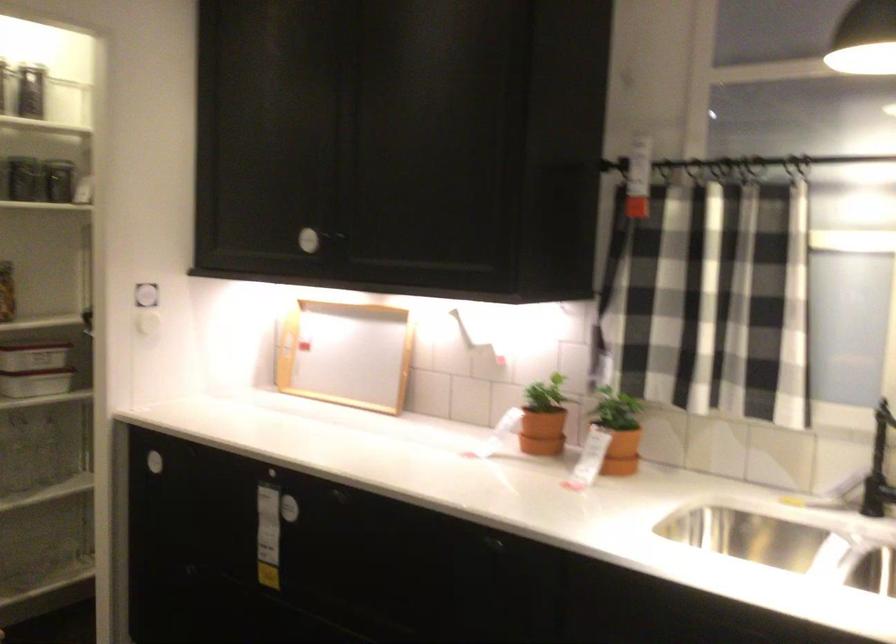
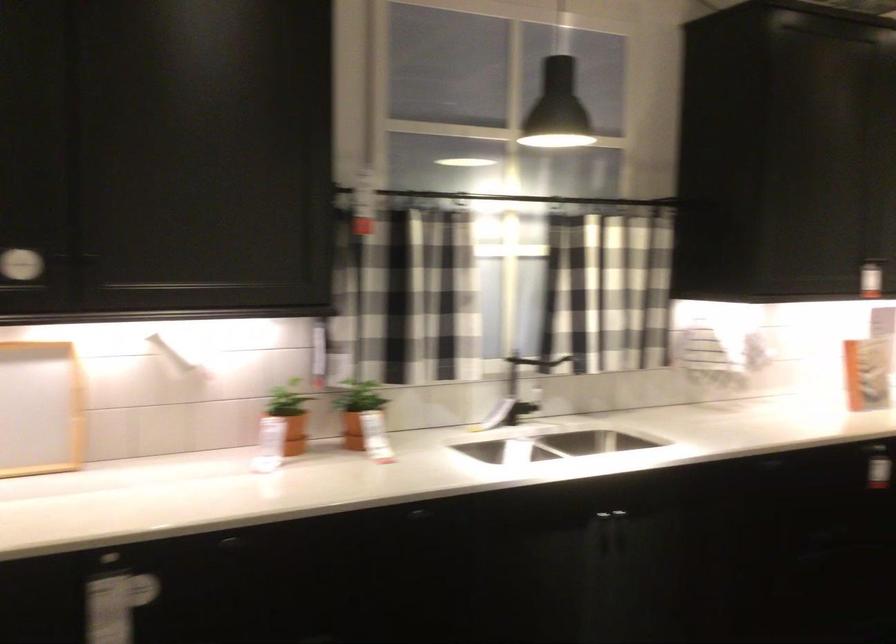
Where in the second image is the point corresponding to point (614, 421) from the first image?

(357, 410)